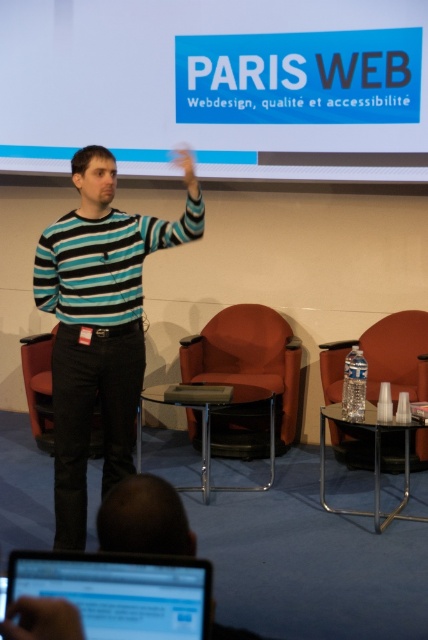
You are an attendee at the conference, and you need to take a photo of the presentation. The blue plastic projection screen at upper center and the matte black laptop at lower left are both in your camera frame. Which object will appear larger in your photo?

The blue plastic projection screen at upper center will appear larger in the photo because it is much taller than the matte black laptop at lower left.

You are attending a conference on web design and need to take a photo of the speaker and their laptop. The camera you have can only focus on objects within a 1.2 meter width. Given that the striped cotton shirt at center and the matte black laptop at lower left are in the frame, will both fit within the camera focus width?

The striped cotton shirt at center might be wider than matte black laptop at lower left, so there is a possibility that the total width of both objects exceeds the camera focus limit of 1.2 meters. To ensure both fit, adjust the camera angle or zoom to frame them within the allowed width.

You are a stagehand adjusting the lighting for the presentation. The speaker is about to demonstrate a feature on the blue plastic projection screen at upper center. To ensure the matte black hand at upper center doesn not cast a distracting shadow on the screen, should you position the light source closer to or farther from the screen?

The distance between the blue plastic projection screen at upper center and the matte black hand at upper center is 5.67 feet. To prevent the hand from casting a shadow on the screen, the light source should be positioned farther from the screen. This way, the shadow will fall behind the hand, away from the screen, ensuring it doesn not interfere with the presentation.